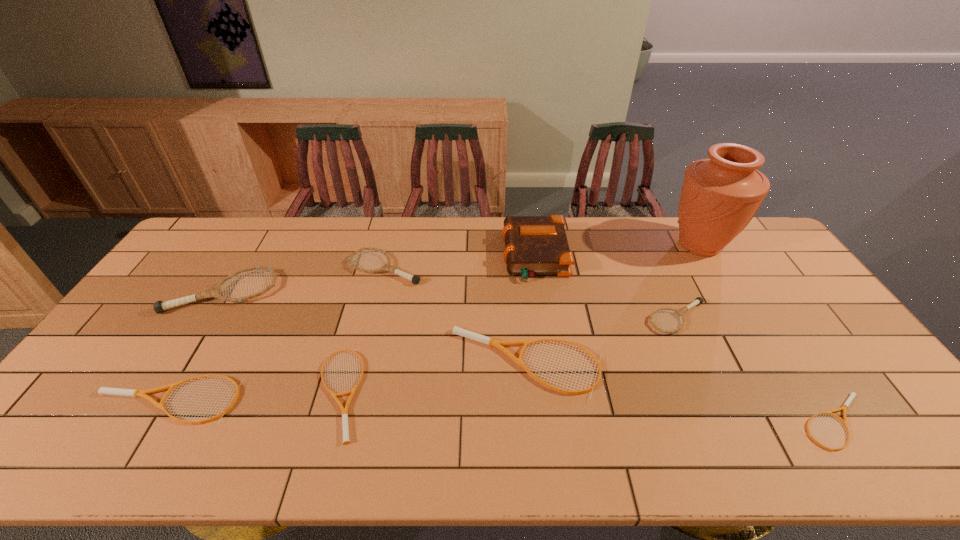
Where is `vase`? The height and width of the screenshot is (540, 960). vase is located at coordinates [720, 195].

Where is `terracotta vase`? The image size is (960, 540). terracotta vase is located at coordinates point(720,195).

Locate an element on the screen. This screenshot has height=540, width=960. Bible is located at coordinates (534, 245).

The height and width of the screenshot is (540, 960). I want to click on the third tallest object, so coord(159,307).

You are a GUI agent. You are given a task and a screenshot of the screen. Output one action in this format:
    pyautogui.click(x=<x>, y=<y>)
    Task: Click on the biggest gray tennis racket
    The image size is (960, 540).
    Given the screenshot: What is the action you would take?
    pyautogui.click(x=159, y=307)

Where is `the second gray tennis racket from left to right`? The height and width of the screenshot is (540, 960). the second gray tennis racket from left to right is located at coordinates (415, 279).

Locate an element on the screen. The image size is (960, 540). the sixth shortest tennis racket is located at coordinates (415, 279).

What are the coordinates of `the smallest gray tennis racket` in the screenshot? It's located at 698,300.

I want to click on the sixth tennis racket from left to right, so click(698, 300).

You are a GUI agent. You are given a task and a screenshot of the screen. Output one action in this format:
    pyautogui.click(x=<x>, y=<y>)
    Task: Click on the third beige tennis racket from left to right
    
    Given the screenshot: What is the action you would take?
    pyautogui.click(x=489, y=341)